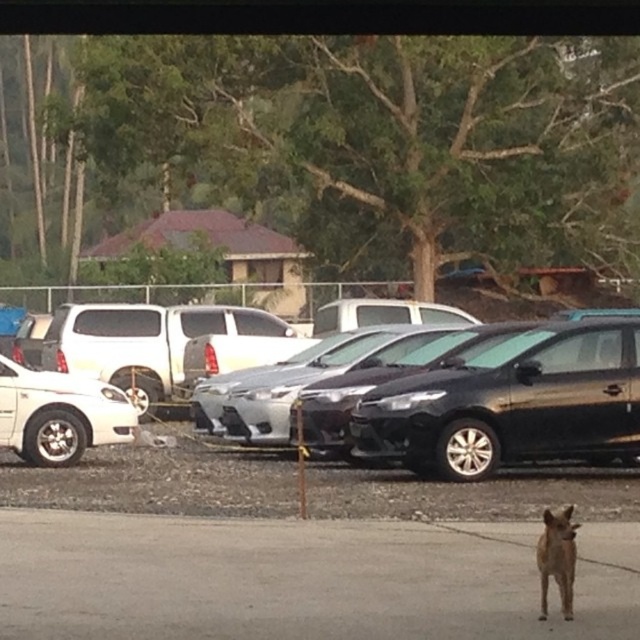
Question: Does glossy black car at center have a greater width compared to brown furry dog at lower right?

Choices:
 (A) no
 (B) yes

Answer: (B)

Question: Is brown fur dog at lower center to the right of brown furry dog at lower right from the viewer's perspective?

Choices:
 (A) no
 (B) yes

Answer: (A)

Question: Which object is closer to the camera taking this photo?

Choices:
 (A) brown fur dog at lower center
 (B) satin black sedan at center
 (C) white matte sedan at left
 (D) brown furry dog at lower right

Answer: (D)

Question: Does brown fur dog at lower center appear on the right side of white matte sedan at left?

Choices:
 (A) no
 (B) yes

Answer: (B)

Question: Which point is closer to the camera?

Choices:
 (A) (547, 566)
 (B) (595, 454)
 (C) (29, 401)
 (D) (134, 624)

Answer: (D)

Question: Among these objects, which one is nearest to the camera?

Choices:
 (A) glossy black car at center
 (B) white matte sedan at left
 (C) satin black sedan at center
 (D) brown fur dog at lower center

Answer: (D)